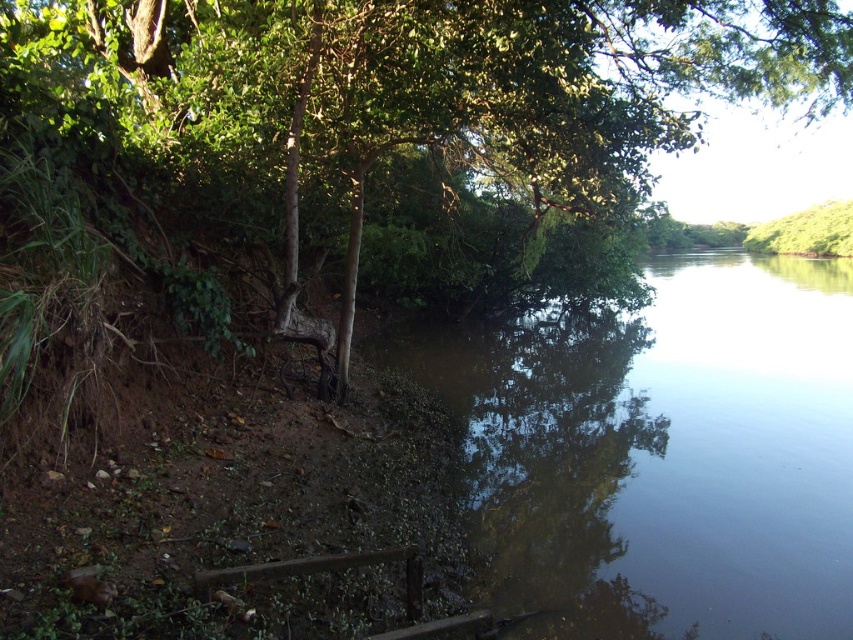
Can you confirm if brown murky water at center is shorter than green leafy tree at left?

No, brown murky water at center is not shorter than green leafy tree at left.

Who is shorter, brown murky water at center or green leafy tree at left?

Standing shorter between the two is green leafy tree at left.

Between point (527, 419) and point (206, 32), which one is positioned behind?

Point (527, 419)

Where is `brown murky water at center`? brown murky water at center is located at coordinates (662, 451).